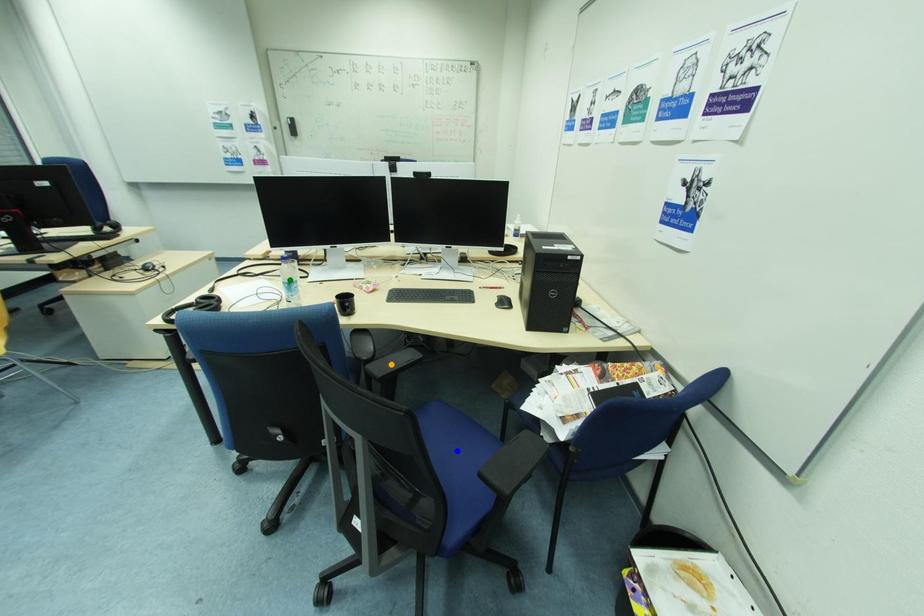
Order these from nearest to farthest:
orange point | blue point | green point

1. blue point
2. green point
3. orange point